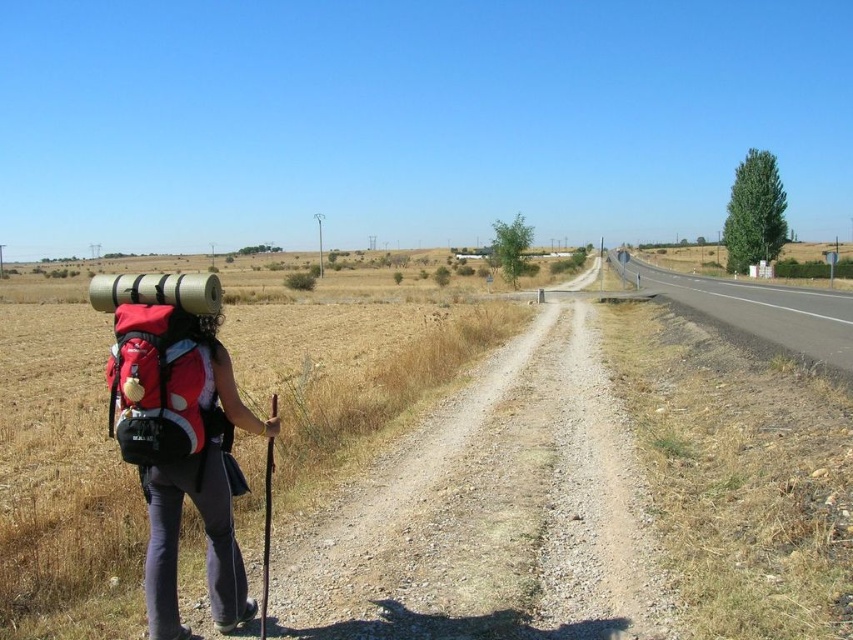
From the picture: Does matte red backpack at left lie in front of red fabric backpack at left?

Yes, matte red backpack at left is in front of red fabric backpack at left.

Is point (136, 332) closer to camera compared to point (222, 408)?

That is True.

Where is `matte red backpack at left`? Image resolution: width=853 pixels, height=640 pixels. matte red backpack at left is located at coordinates (161, 385).

Is dusty gravel path at center further to the viewer compared to matte red backpack at left?

Yes, dusty gravel path at center is behind matte red backpack at left.

Can you confirm if dusty gravel path at center is taller than matte red backpack at left?

Correct, dusty gravel path at center is much taller as matte red backpack at left.

Is point (518, 516) less distant than point (123, 381)?

No, it is behind (123, 381).

Image resolution: width=853 pixels, height=640 pixels. In order to click on dusty gravel path at center in this screenshot , I will do `click(490, 513)`.

Can you confirm if matte red backpack at left is taller than asphalt road at right?

Incorrect, matte red backpack at left's height is not larger of asphalt road at right's.

Which is more to the left, matte red backpack at left or asphalt road at right?

matte red backpack at left is more to the left.

Does point (115, 433) come closer to viewer compared to point (701, 317)?

Yes, point (115, 433) is in front of point (701, 317).

Find the location of a particular element. This screenshot has height=640, width=853. matte red backpack at left is located at coordinates (161, 385).